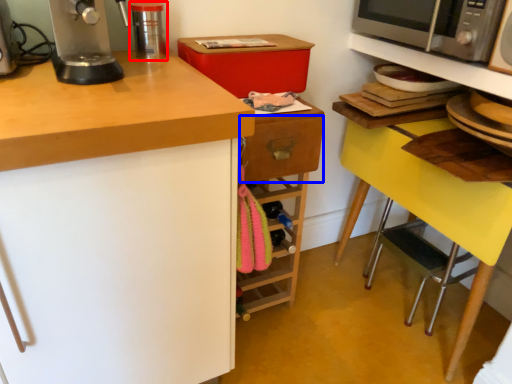
Question: Which of the following is the closest to the observer, kitchen appliance (highlighted by a red box) or drawer (highlighted by a blue box)?

Choices:
 (A) kitchen appliance
 (B) drawer

Answer: (A)